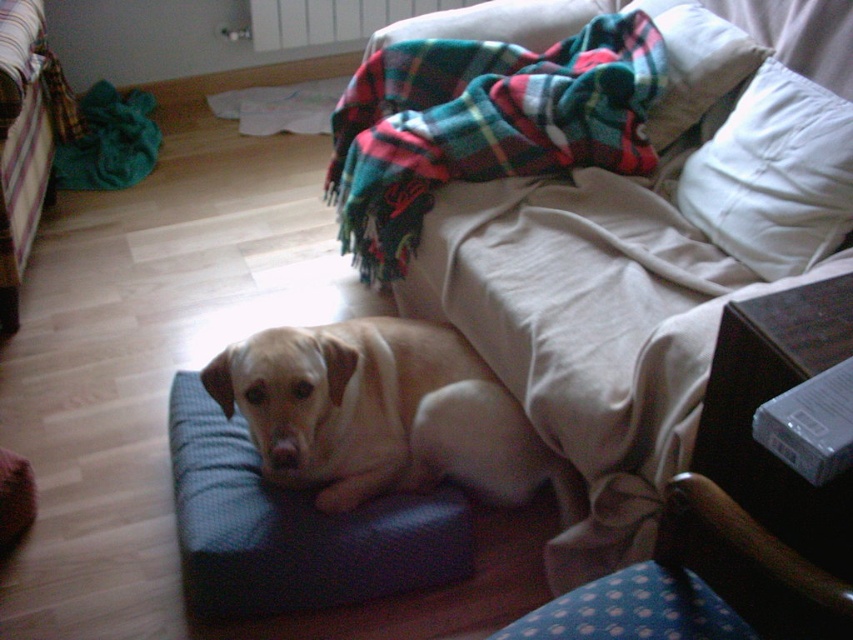
Question: Based on their relative distances, which object is nearer to the plaid woolen blanket at upper center?

Choices:
 (A) light beige fur at center
 (B) plaid fabric pillow at upper right
 (C) blue fabric dog bed at center
 (D) white soft pillow at upper right

Answer: (B)

Question: Estimate the real-world distances between objects in this image. Which object is farther from the plaid fabric pillow at upper right?

Choices:
 (A) blue fabric dog bed at center
 (B) plaid woolen blanket at upper center
 (C) light beige fur at center
 (D) white soft pillow at upper right

Answer: (A)

Question: Can you confirm if blue fabric dog bed at center is thinner than white soft pillow at upper right?

Choices:
 (A) no
 (B) yes

Answer: (A)

Question: Can you confirm if light beige fur at center is positioned above blue fabric dog bed at center?

Choices:
 (A) no
 (B) yes

Answer: (B)

Question: Can you confirm if light beige fur at center is bigger than plaid fabric pillow at upper right?

Choices:
 (A) yes
 (B) no

Answer: (A)

Question: Estimate the real-world distances between objects in this image. Which object is closer to the blue fabric dog bed at center?

Choices:
 (A) white soft pillow at upper right
 (B) light beige fur at center
 (C) plaid woolen blanket at upper center

Answer: (B)